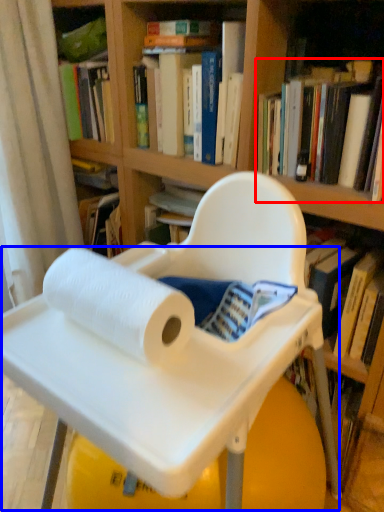
Question: Which object is closer to the camera taking this photo, book (highlighted by a red box) or table (highlighted by a blue box)?

Choices:
 (A) book
 (B) table

Answer: (B)